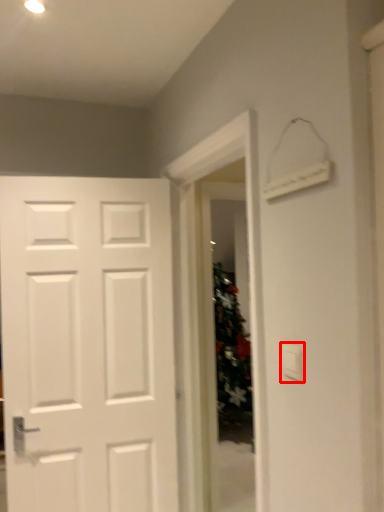
Question: Where is light switch (annotated by the red box) located in relation to glass door in the image?

Choices:
 (A) left
 (B) right

Answer: (B)